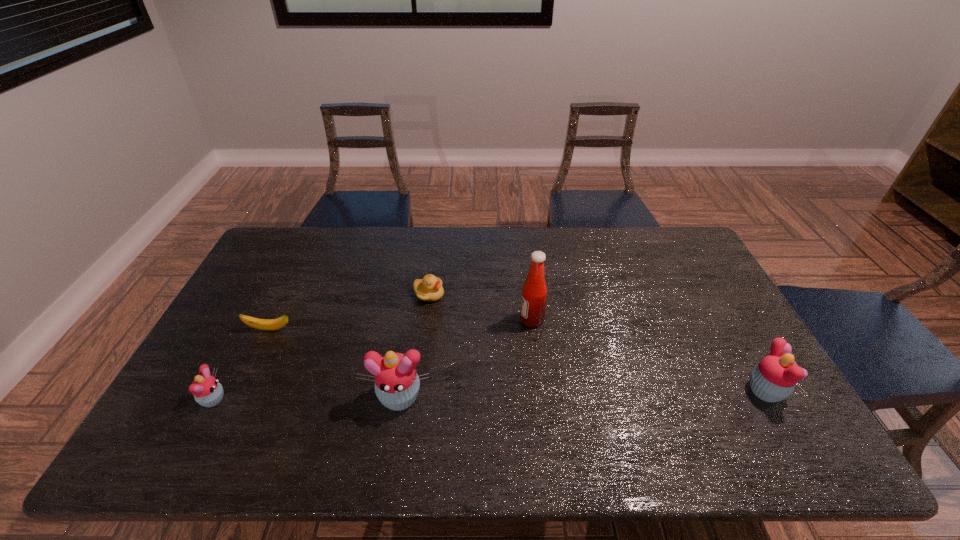
Locate an element on the screen. the leftmost cupcake is located at coordinates 207,391.

Identify the location of the fourth tallest object. (207, 391).

I want to click on the second cupcake from left to right, so click(397, 383).

Image resolution: width=960 pixels, height=540 pixels. Identify the location of the second tallest cupcake. (774, 378).

You are a GUI agent. You are given a task and a screenshot of the screen. Output one action in this format:
    pyautogui.click(x=<x>, y=<y>)
    Task: Click on the rightmost object
    The width and height of the screenshot is (960, 540).
    Given the screenshot: What is the action you would take?
    pyautogui.click(x=774, y=378)

At what (x,y) coordinates should I click in order to perform the action: click on condiment. Please return your answer as a coordinate pair (x, y). Looking at the image, I should click on (534, 293).

Where is `the second object from right to left`? Image resolution: width=960 pixels, height=540 pixels. the second object from right to left is located at coordinates (534, 293).

This screenshot has height=540, width=960. What are the coordinates of `the farthest object` in the screenshot? It's located at (429, 289).

At what (x,y) coordinates should I click in order to perform the action: click on banana. Please return your answer as a coordinate pair (x, y). The width and height of the screenshot is (960, 540). Looking at the image, I should click on (264, 324).

Where is `free space located 0.190m on the face of the fourth tallest object`? Image resolution: width=960 pixels, height=540 pixels. free space located 0.190m on the face of the fourth tallest object is located at coordinates (300, 400).